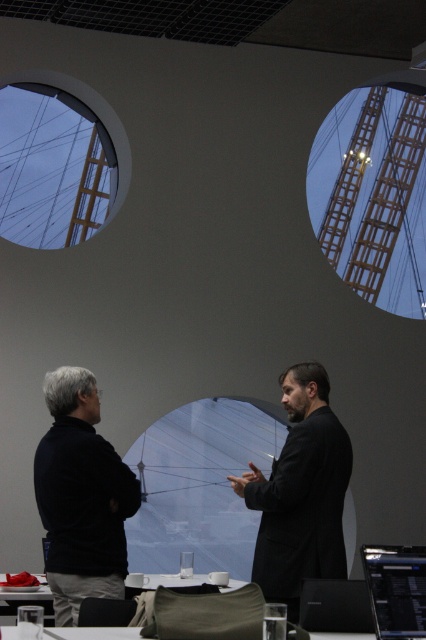
The image size is (426, 640). What do you see at coordinates (80, 497) in the screenshot?
I see `black matte jacket at left` at bounding box center [80, 497].

Between black matte jacket at left and black matte laptop at center, which one has less height?

With less height is black matte laptop at center.

Who is more distant from viewer, [74,474] or [319,586]?

Positioned behind is point [74,474].

Locate an element on the screen. The image size is (426, 640). black matte jacket at left is located at coordinates (80, 497).

Can you confirm if black matte suit at center is positioned to the right of translucent plastic table at center?

Indeed, black matte suit at center is positioned on the right side of translucent plastic table at center.

Does black matte suit at center have a greater height compared to translucent plastic table at center?

Yes, black matte suit at center is taller than translucent plastic table at center.

Find the location of a particular element. This screenshot has width=426, height=640. black matte suit at center is located at coordinates (301, 492).

Image resolution: width=426 pixels, height=640 pixels. Identify the location of black matte jacket at left. (80, 497).

Which is in front, point (36, 460) or point (244, 486)?

Point (36, 460) is in front.

Identify the location of black matte jacket at left. The width and height of the screenshot is (426, 640). (80, 497).